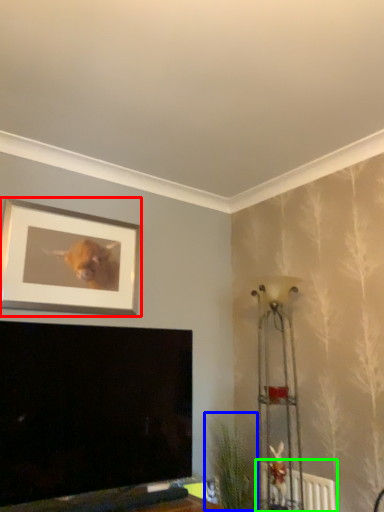
Question: Considering the real-world distances, which object is closest to picture frame (highlighted by a red box)? plant (highlighted by a blue box) or radiator (highlighted by a green box).

Choices:
 (A) plant
 (B) radiator

Answer: (A)